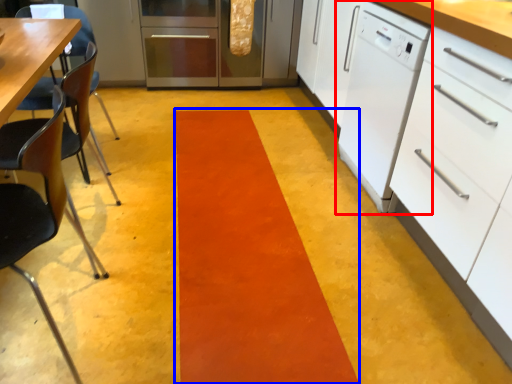
Question: Which point is closer to the camera, home appliance (highlighted by a red box) or strip (highlighted by a blue box)?

Choices:
 (A) home appliance
 (B) strip

Answer: (B)